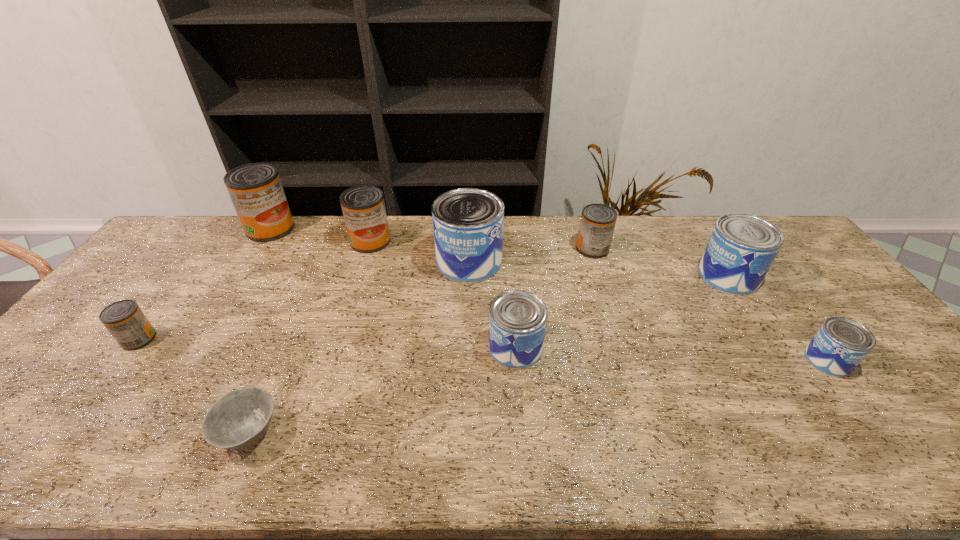
What are the coordinates of `vacant space at the far edge` in the screenshot? It's located at (348, 246).

In the image, there is a desktop. In order to click on free space at the near edge in this screenshot , I will do `click(566, 443)`.

This screenshot has height=540, width=960. In order to click on vacant space at the left edge in this screenshot , I will do `click(153, 298)`.

Where is `vacant region at the right edge of the desktop`? vacant region at the right edge of the desktop is located at coordinates (780, 269).

Identify the location of vacant space at the far left corner of the desktop. (196, 230).

Locate an element on the screen. vacant region at the far right corner of the desktop is located at coordinates (785, 249).

Where is `free space between the leftmost object and the second biggest blue can`? This screenshot has width=960, height=540. free space between the leftmost object and the second biggest blue can is located at coordinates (434, 307).

Find the location of `free spot between the third biggest blue can and the bowl`. free spot between the third biggest blue can and the bowl is located at coordinates (383, 390).

At what (x,y) coordinates should I click in order to perform the action: click on free spot between the bowl and the nearest red can. Please return your answer as a coordinate pair (x, y). Image resolution: width=960 pixels, height=540 pixels. Looking at the image, I should click on (194, 386).

Identify the location of vacant area that lies between the third biggest blue can and the smallest blue can. This screenshot has height=540, width=960. (672, 354).